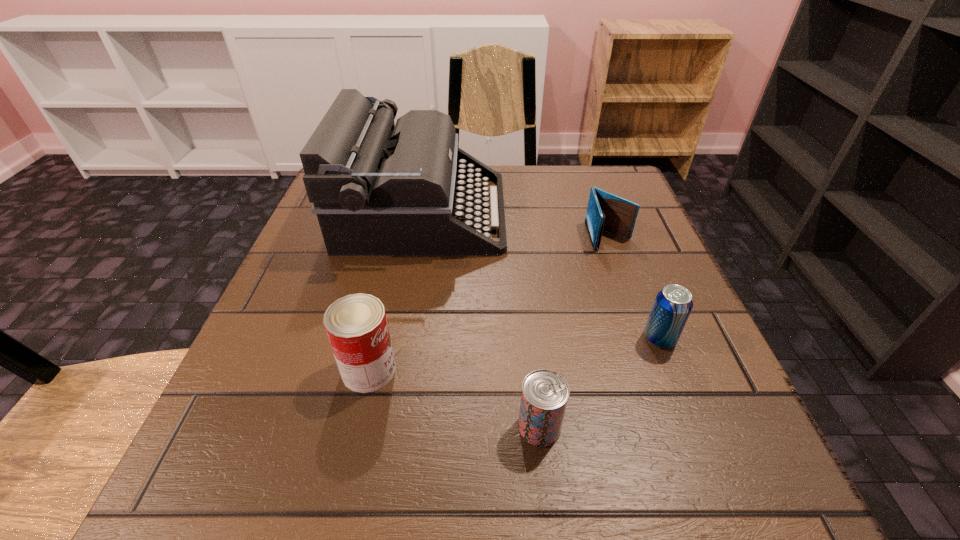
At what (x,y) coordinates should I click in order to perform the action: click on typewriter. Please return your answer as a coordinate pair (x, y). This screenshot has width=960, height=540. Looking at the image, I should click on (378, 188).

Identify the location of can. (356, 325).

This screenshot has height=540, width=960. In order to click on the right beer can in this screenshot , I will do `click(673, 304)`.

Where is `the nearest object`? The height and width of the screenshot is (540, 960). the nearest object is located at coordinates (545, 393).

You are a GUI agent. You are given a task and a screenshot of the screen. Output one action in this format:
    pyautogui.click(x=<x>, y=<y>)
    Task: Click on the nearer beer can
    
    Given the screenshot: What is the action you would take?
    pyautogui.click(x=545, y=393)

Locate an element on the screen. Image resolution: width=960 pixels, height=540 pixels. wallet is located at coordinates (605, 211).

Where is `free space located 0.270m on the typing side of the tallest object`? Image resolution: width=960 pixels, height=540 pixels. free space located 0.270m on the typing side of the tallest object is located at coordinates (x=624, y=212).

I want to click on vacant space located 0.140m on the front label of the fourth shortest object, so click(488, 370).

Find the location of a particular element. free spot located on the back of the farther beer can is located at coordinates (608, 205).

Find the location of `free region located on the left of the left beer can`. free region located on the left of the left beer can is located at coordinates (416, 427).